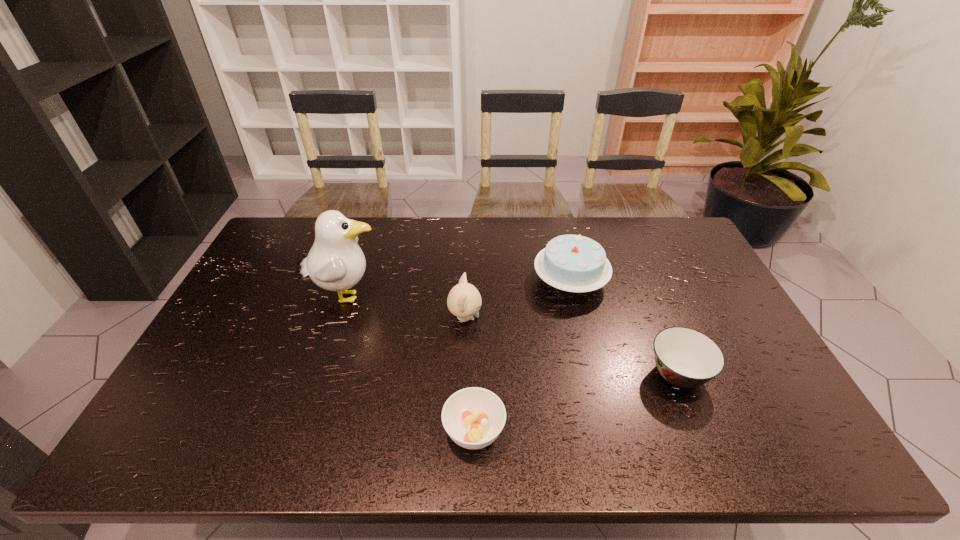
Where is `vacant space that satisfies the following two spatial constraints: 1. on the front side of the birthday cake; 2. on the face of the kitten`? This screenshot has width=960, height=540. vacant space that satisfies the following two spatial constraints: 1. on the front side of the birthday cake; 2. on the face of the kitten is located at coordinates (579, 318).

Locate an element on the screen. blank space that satisfies the following two spatial constraints: 1. on the back side of the second object from right to left; 2. on the right side of the shortest object is located at coordinates (476, 281).

Find the location of `vacant space that satisfies the following two spatial constraints: 1. on the beak of the tallest object; 2. on the left side of the right soup bowl`. vacant space that satisfies the following two spatial constraints: 1. on the beak of the tallest object; 2. on the left side of the right soup bowl is located at coordinates (319, 374).

Identify the location of vacant space that satisfies the following two spatial constraints: 1. on the face of the nearer soup bowl; 2. on the left side of the kitten. The height and width of the screenshot is (540, 960). (461, 431).

I want to click on free space that satisfies the following two spatial constraints: 1. on the back side of the birthday cake; 2. on the left side of the left soup bowl, so [476, 281].

I want to click on free space that satisfies the following two spatial constraints: 1. on the back side of the left soup bowl; 2. on the beak of the gull, so pos(475,296).

The height and width of the screenshot is (540, 960). What are the coordinates of `vacant space that satisfies the following two spatial constraints: 1. on the beak of the tallest object; 2. on the left side of the nearer soup bowl` in the screenshot? It's located at (300, 431).

I want to click on free space that satisfies the following two spatial constraints: 1. on the face of the kitten; 2. on the right side of the shortest object, so click(461, 431).